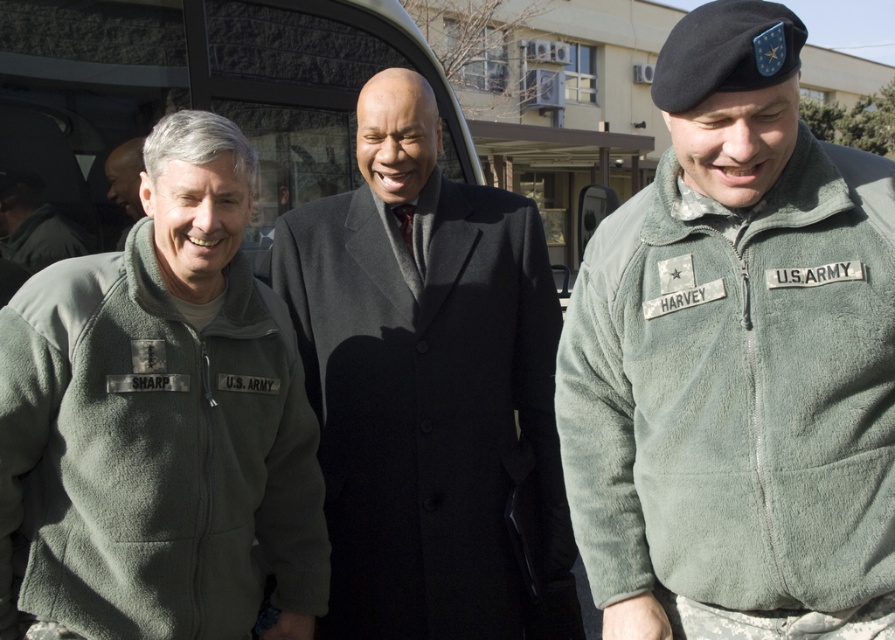
You are a photographer at this event and need to capture a photo that includes both the black wool coat at center and the metallic gray van at center. Based on their positions, which object should be placed on the left side of the photo to ensure both are visible?

The metallic gray van at center should be placed on the left side of the photo because the black wool coat at center is to the right of it, ensuring both are visible in the frame.

You are a photographer at this event and want to capture a photo where both the sage fleece jacket at right and the matte black coat at center are clearly visible. Based on their positions, which one should you focus on first to ensure both are in frame?

The sage fleece jacket at right is positioned under the matte black coat at center, so focusing on the matte black coat at center first will help ensure both are in frame.

In the scene described, where is the black wool coat at center located in terms of coordinates?

The black wool coat at center is located at point coordinates of (430, 390).